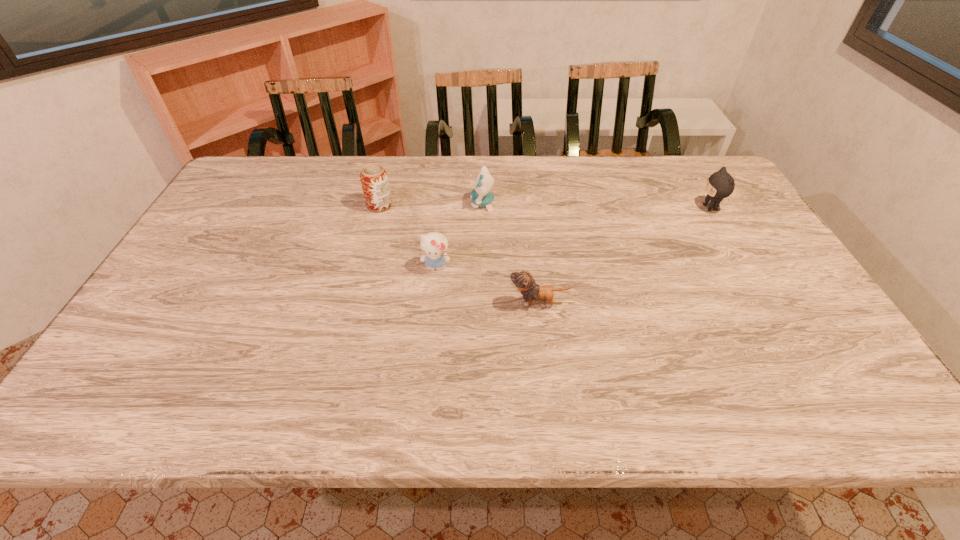
In order to click on the leftmost object in this screenshot , I will do [374, 180].

Identify the location of the rightmost kitten. (720, 185).

At what (x,y) coordinates should I click in order to perform the action: click on the third kitten from right to left. Please return your answer as a coordinate pair (x, y). Image resolution: width=960 pixels, height=540 pixels. Looking at the image, I should click on (480, 196).

The width and height of the screenshot is (960, 540). Find the location of `the third farthest kitten`. the third farthest kitten is located at coordinates tap(434, 245).

Identify the location of the leftmost kitten. The image size is (960, 540). tap(434, 245).

You are a GUI agent. You are given a task and a screenshot of the screen. Output one action in this format:
    pyautogui.click(x=<x>, y=<y>)
    Task: Click on the nearest object
    
    Given the screenshot: What is the action you would take?
    pyautogui.click(x=523, y=281)

I want to click on the fourth object from left to right, so click(523, 281).

You are a GUI agent. You are given a task and a screenshot of the screen. Output one action in this format:
    pyautogui.click(x=<x>, y=<y>)
    Task: Click on the vacant space located on the right of the beer can
    The height and width of the screenshot is (540, 960).
    Given the screenshot: What is the action you would take?
    pyautogui.click(x=444, y=206)

I want to click on vacant space located 0.290m on the front-facing side of the rightmost object, so click(605, 208).

The height and width of the screenshot is (540, 960). Find the location of `vacant space located 0.330m on the front-facing side of the rightmost object`. vacant space located 0.330m on the front-facing side of the rightmost object is located at coordinates (592, 208).